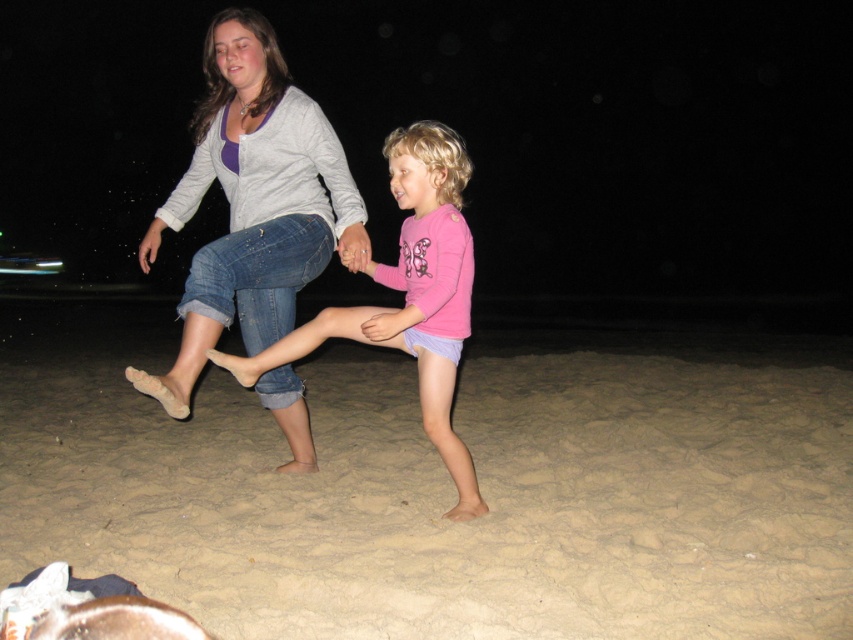
You are a photographer trying to capture the scene where the woman and girl are playing on the beach. You want to ensure the pink matte shirt at center and the light brown sandy beach at lower center are both visible in the frame. Based on their positions, which object should you focus on first to include both in the shot?

The pink matte shirt at center should be focused on first because the light brown sandy beach at lower center is to the right of it, meaning the shirt is closer to the photographer and the beach extends to its right, allowing both to be captured by framing from the shirt outward.

You are planning to build a sandcastle on the light brown sandy beach at lower center. Considering the space available compared to the denim jeans at center, will you have enough room to construct a medium sized sandcastle?

The light brown sandy beach at lower center occupies less space than the denim jeans at center. Since the sand area is smaller, you might not have enough room to build a medium sized sandcastle there.

Based on the scene description, what does the point at coordinates (450, 493) represent?

The point at coordinates (450, 493) represents the light brown sandy beach at lower center.